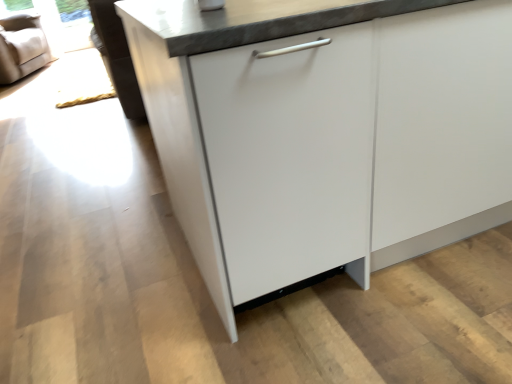
You are a GUI agent. You are given a task and a screenshot of the screen. Output one action in this format:
    pyautogui.click(x=<x>, y=<y>)
    Task: Click on the beige fabric armchair at upper left
    
    Given the screenshot: What is the action you would take?
    pyautogui.click(x=21, y=47)

What do you see at coordinates (325, 133) in the screenshot? This screenshot has width=512, height=384. I see `white glossy cabinet at center` at bounding box center [325, 133].

Find the location of a particular element. This screenshot has width=512, height=384. beige fabric armchair at upper left is located at coordinates (21, 47).

Is white glossy cabinet at center oriented towards beige fabric armchair at upper left?

No, white glossy cabinet at center is not aimed at beige fabric armchair at upper left.

Which object is closer to the camera taking this photo, white glossy cabinet at center or beige fabric armchair at upper left?

white glossy cabinet at center is closer to the camera.

From a real-world perspective, is white glossy cabinet at center physically located above or below beige fabric armchair at upper left?

In terms of real-world spatial position, white glossy cabinet at center is above beige fabric armchair at upper left.

From their relative heights in the image, would you say white glossy cabinet at center is taller or shorter than beige fabric armchair at upper left?

white glossy cabinet at center is taller than beige fabric armchair at upper left.

Is transparent glass window screen at upper left outside of beige fabric armchair at upper left?

Yes, transparent glass window screen at upper left is located beyond the bounds of beige fabric armchair at upper left.

Is transparent glass window screen at upper left next to beige fabric armchair at upper left?

No, transparent glass window screen at upper left is not making contact with beige fabric armchair at upper left.

Considering the relative sizes of transparent glass window screen at upper left and beige fabric armchair at upper left in the image provided, is transparent glass window screen at upper left shorter than beige fabric armchair at upper left?

Indeed, transparent glass window screen at upper left has a lesser height compared to beige fabric armchair at upper left.

From the picture: Is transparent glass window screen at upper left wider or thinner than beige fabric armchair at upper left?

transparent glass window screen at upper left is thinner than beige fabric armchair at upper left.

From a real-world perspective, which object stands above the other?

white glossy cabinet at center is physically above.

Considering the relative sizes of white glossy cabinet at center and transparent glass window screen at upper left in the image provided, is white glossy cabinet at center taller than transparent glass window screen at upper left?

Indeed, white glossy cabinet at center has a greater height compared to transparent glass window screen at upper left.

From the image's perspective, between white glossy cabinet at center and transparent glass window screen at upper left, who is located below?

white glossy cabinet at center is shown below in the image.

Is point (163, 172) positioned before point (53, 9)?

Yes, point (163, 172) is closer to viewer.

From the image's perspective, between transparent glass window screen at upper left and white glossy cabinet at center, which one is located above?

transparent glass window screen at upper left is shown above in the image.

Locate an element on the screen. cabinetry in front of the transparent glass window screen at upper left is located at coordinates (325, 133).

Which of these two, transparent glass window screen at upper left or white glossy cabinet at center, is wider?

With larger width is white glossy cabinet at center.

Is beige fabric armchair at upper left positioned with its back to white glossy cabinet at center?

That's not correct — beige fabric armchair at upper left is not looking away from white glossy cabinet at center.

Is beige fabric armchair at upper left smaller than white glossy cabinet at center?

Yes.

Is beige fabric armchair at upper left taller or shorter than white glossy cabinet at center?

Clearly, beige fabric armchair at upper left is shorter compared to white glossy cabinet at center.

Is beige fabric armchair at upper left taller or shorter than transparent glass window screen at upper left?

Clearly, beige fabric armchair at upper left is taller compared to transparent glass window screen at upper left.

Does point (41, 33) appear closer or farther from the camera than point (59, 42)?

Point (41, 33) appears to be closer to the viewer than point (59, 42).

Is beige fabric armchair at upper left facing away from transparent glass window screen at upper left?

No, beige fabric armchair at upper left is not facing the opposite direction of transparent glass window screen at upper left.

Between beige fabric armchair at upper left and transparent glass window screen at upper left, which one appears on the right side from the viewer's perspective?

Positioned to the right is transparent glass window screen at upper left.

Image resolution: width=512 pixels, height=384 pixels. What are the coordinates of `cabinetry below the beige fabric armchair at upper left (from the image's perspective)` in the screenshot? It's located at (325, 133).

Locate an element on the screen. window screen behind the beige fabric armchair at upper left is located at coordinates (58, 20).

Estimate the real-world distances between objects in this image. Which object is further from beige fabric armchair at upper left, transparent glass window screen at upper left or white glossy cabinet at center?

Based on the image, white glossy cabinet at center appears to be further to beige fabric armchair at upper left.

From the image, which object appears to be nearer to beige fabric armchair at upper left, white glossy cabinet at center or transparent glass window screen at upper left?

transparent glass window screen at upper left lies closer to beige fabric armchair at upper left than the other object.

Which object lies nearer to the anchor point white glossy cabinet at center, transparent glass window screen at upper left or beige fabric armchair at upper left?

Among the two, beige fabric armchair at upper left is located nearer to white glossy cabinet at center.

Based on their spatial positions, is beige fabric armchair at upper left or transparent glass window screen at upper left further from white glossy cabinet at center?

Based on the image, transparent glass window screen at upper left appears to be further to white glossy cabinet at center.

Estimate the real-world distances between objects in this image. Which object is further from transparent glass window screen at upper left, beige fabric armchair at upper left or white glossy cabinet at center?

Among the two, white glossy cabinet at center is located further to transparent glass window screen at upper left.

Looking at the image, which one is located further to transparent glass window screen at upper left, white glossy cabinet at center or beige fabric armchair at upper left?

white glossy cabinet at center.

Locate an element on the screen. armchair between white glossy cabinet at center and transparent glass window screen at upper left along the z-axis is located at coordinates pos(21,47).